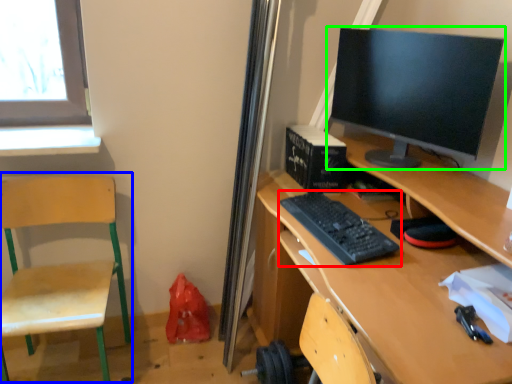
Question: Which object is positioned closest to computer keyboard (highlighted by a red box)? Select from swivel chair (highlighted by a blue box) and computer monitor (highlighted by a green box).

Choices:
 (A) swivel chair
 (B) computer monitor

Answer: (B)